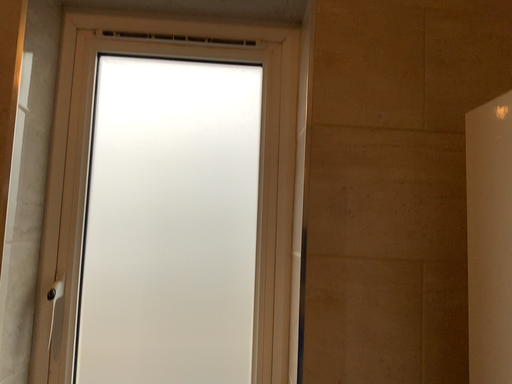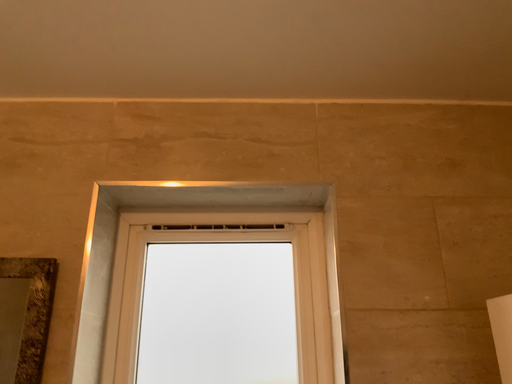
Question: Which way did the camera rotate in the video?

Choices:
 (A) rotated downward
 (B) rotated upward

Answer: (B)